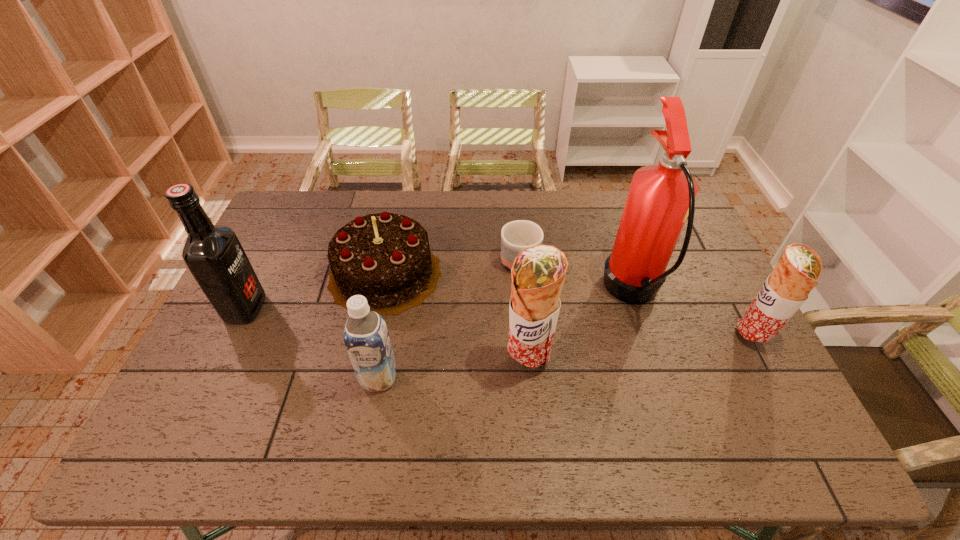
Locate an element on the screen. This screenshot has width=960, height=540. blank space located on the back of the shorter burrito is located at coordinates (701, 240).

Find the location of a particular element. Image resolution: width=960 pixels, height=540 pixels. free spot located 0.180m on the back of the second shortest object is located at coordinates [399, 205].

Image resolution: width=960 pixels, height=540 pixels. Find the location of `blank space located on the side with the handle of the mug`. blank space located on the side with the handle of the mug is located at coordinates (533, 408).

Identify the location of vacant space located 0.270m at the spray nozzle of the fire extinguisher. Image resolution: width=960 pixels, height=540 pixels. (515, 293).

Image resolution: width=960 pixels, height=540 pixels. I want to click on vacant region located at the spray nozzle of the fire extinguisher, so click(564, 293).

At what (x,y) coordinates should I click in order to perform the action: click on vacant space located at the spray nozzle of the fire extinguisher. Please return your answer as a coordinate pair (x, y). Looking at the image, I should click on (574, 293).

Locate an element on the screen. This screenshot has width=960, height=540. free location located 0.070m on the front-facing side of the leftmost object is located at coordinates 287,308.

The height and width of the screenshot is (540, 960). Find the location of `object at the near edge`. object at the near edge is located at coordinates point(366,337).

Find the location of `object that is at the left edge`. object that is at the left edge is located at coordinates (214, 255).

Locate an element on the screen. The image size is (960, 540). object present at the right edge is located at coordinates (786, 289).